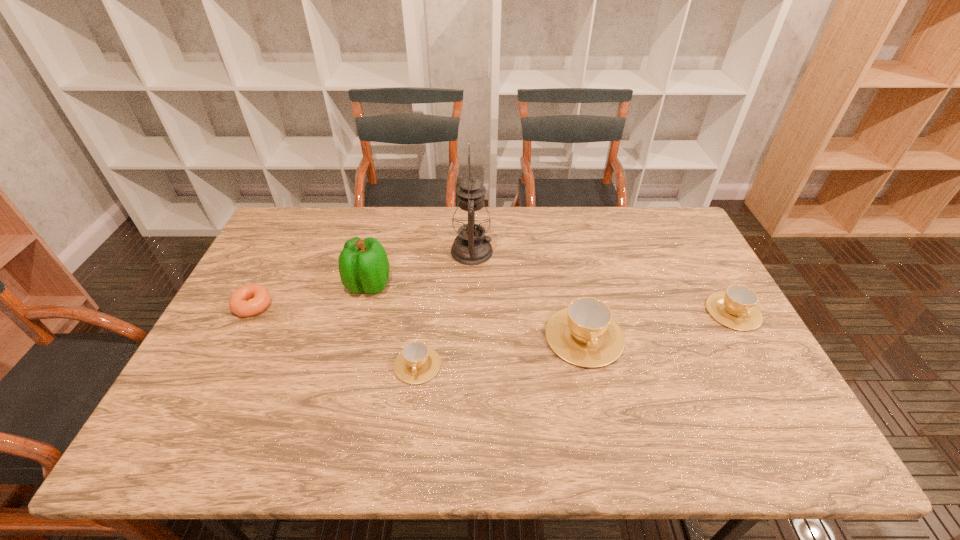
The width and height of the screenshot is (960, 540). I want to click on the shortest cup, so click(x=417, y=363).

Where is `the third object from left to right`? Image resolution: width=960 pixels, height=540 pixels. the third object from left to right is located at coordinates (417, 363).

Where is `the second cup from left to right`? The width and height of the screenshot is (960, 540). the second cup from left to right is located at coordinates (584, 334).

Image resolution: width=960 pixels, height=540 pixels. What are the coordinates of `the fifth object from left to right` in the screenshot? It's located at (584, 334).

Image resolution: width=960 pixels, height=540 pixels. In order to click on the second shortest cup in this screenshot , I will do click(x=736, y=308).

Identify the location of the rightmost cup. (736, 308).

At what (x,y) coordinates should I click in order to perform the action: click on the tallest object. Please return your answer as a coordinate pair (x, y). Looking at the image, I should click on (471, 220).

Locate an element on the screen. oil lamp is located at coordinates (471, 220).

In order to click on the leftmost object in this screenshot , I will do `click(259, 297)`.

Locate an element on the screen. Image resolution: width=960 pixels, height=540 pixels. the fifth shortest object is located at coordinates (363, 265).